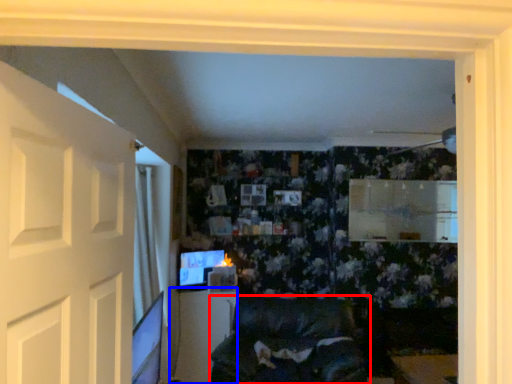
Question: Which object is further to the camera taking this photo, furniture (highlighted by a red box) or table (highlighted by a blue box)?

Choices:
 (A) furniture
 (B) table

Answer: (B)